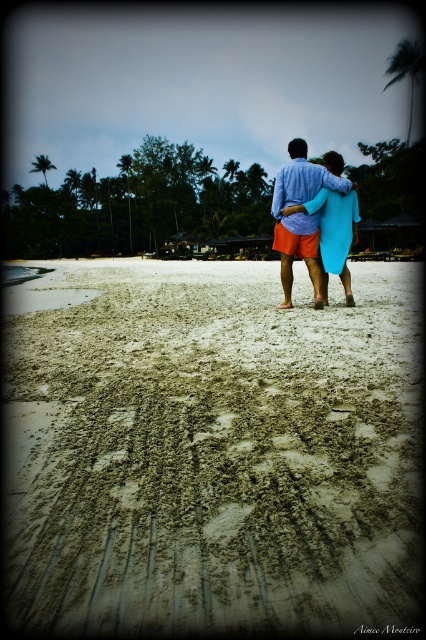
You are standing on the beach and see two points marked in the scene. Which point, point (302, 381) or point (322, 186), is nearer to you?

Point (302, 381) is closer to the viewer than point (322, 186).

You are a photographer planning to capture a sunset shot at this beach. You notice the brown sandy beach at center and the matte blue surfboard at center. Which object takes up more area in the image?

The matte blue surfboard at center takes up more area in the image than the brown sandy beach at center, as the brown sandy beach at center occupies less space than the surfboard.

You are a photographer positioned at the edge of the brown sandy beach at center. You want to take a photo of the two people standing on the beach. How far apart are the two people in the photo?

The two people are 1.58 meters apart.